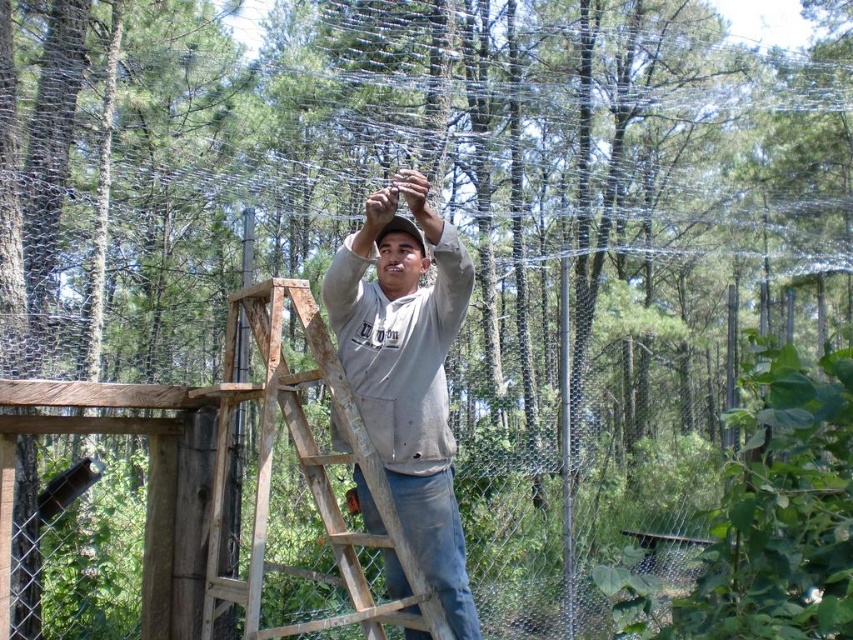
You are standing at the point with coordinates point (422, 579) and want to move towards the point with coordinates point (340, 314). Given the man is working on the fence, will your path be blocked by the ladder?

Point (340, 314) is behind point (422, 579), so moving from point (422, 579) towards point (340, 314) would mean the ladder is between you and your destination. Therefore, your path would be blocked by the ladder.